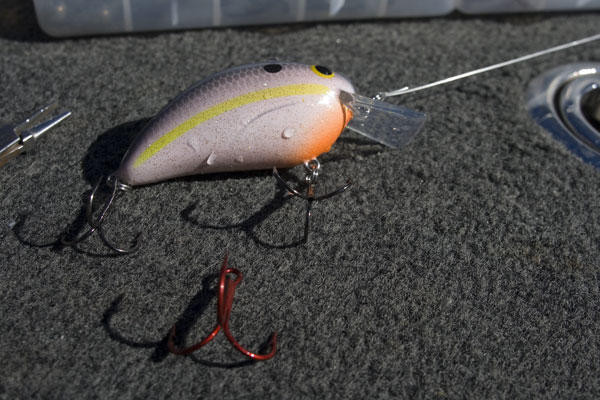
Where is `silver hooks`? silver hooks is located at coordinates (98, 218), (314, 197).